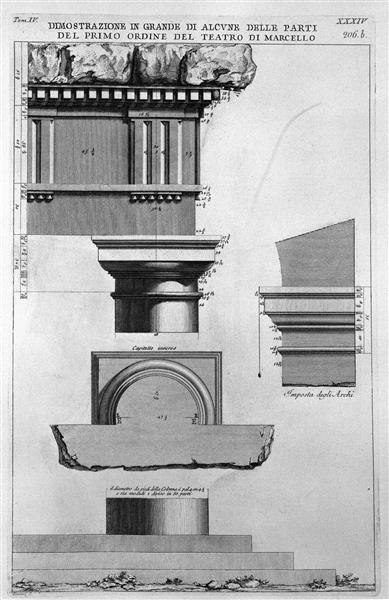
The height and width of the screenshot is (600, 389). I want to click on bottom of pillar, so click(175, 515).